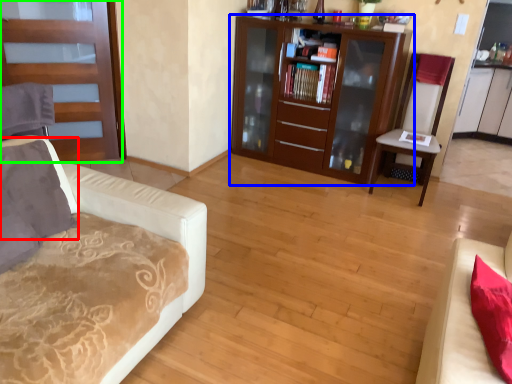
Question: Which object is the closest to the pillow (highlighted by a red box)? Choose among these: cabinetry (highlighted by a blue box) or door (highlighted by a green box).

Choices:
 (A) cabinetry
 (B) door

Answer: (B)